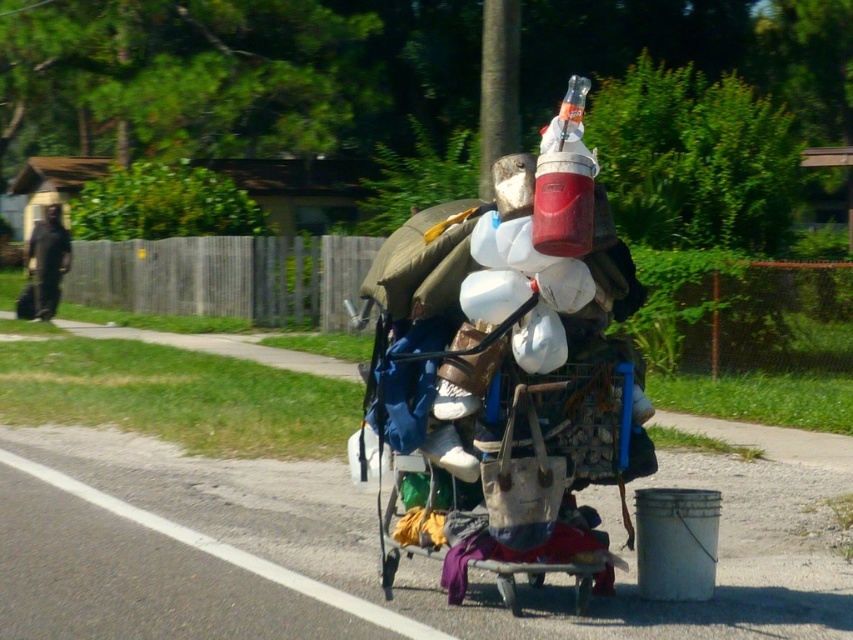
Question: Which point is closer to the camera?

Choices:
 (A) black fabric bag at left
 (B) rusty metal cart at center

Answer: (B)

Question: Which point appears closest to the camera in this image?

Choices:
 (A) (59, 246)
 (B) (556, 470)

Answer: (B)

Question: In this image, where is rusty metal cart at center located relative to black fabric bag at left?

Choices:
 (A) right
 (B) left

Answer: (A)

Question: Is rusty metal cart at center further to camera compared to black fabric bag at left?

Choices:
 (A) no
 (B) yes

Answer: (A)

Question: Can you confirm if rusty metal cart at center is thinner than black fabric bag at left?

Choices:
 (A) no
 (B) yes

Answer: (B)

Question: Which point is closer to the camera?

Choices:
 (A) rusty metal cart at center
 (B) black fabric bag at left

Answer: (A)